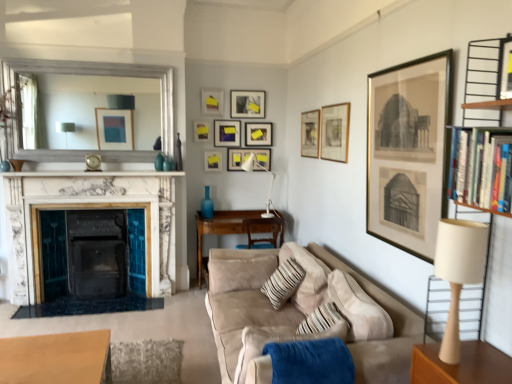
Question: Should I look upward or downward to see matte black picture frame at upper center, which is the 8th picture frame from front to back?

Choices:
 (A) down
 (B) up

Answer: (B)

Question: Is matte black picture frame at upper center, the 3th picture frame positioned from the back, closer to camera compared to suede couch at lower right?

Choices:
 (A) no
 (B) yes

Answer: (A)

Question: Is matte black picture frame at upper center, which is the 8th picture frame from front to back, shorter than suede couch at lower right?

Choices:
 (A) yes
 (B) no

Answer: (A)

Question: Considering the relative positions of matte black picture frame at upper center, the 3th picture frame positioned from the back, and suede couch at lower right in the image provided, is matte black picture frame at upper center, the 3th picture frame positioned from the back, behind suede couch at lower right?

Choices:
 (A) yes
 (B) no

Answer: (A)

Question: From the image's perspective, would you say matte black picture frame at upper center, the 3th picture frame positioned from the back, is shown under suede couch at lower right?

Choices:
 (A) no
 (B) yes

Answer: (A)

Question: Can you confirm if matte black picture frame at upper center, the 3th picture frame positioned from the back, is positioned to the left of suede couch at lower right?

Choices:
 (A) yes
 (B) no

Answer: (A)

Question: From a real-world perspective, is matte black picture frame at upper center, the 3th picture frame positioned from the back, beneath suede couch at lower right?

Choices:
 (A) yes
 (B) no

Answer: (B)

Question: Can you confirm if matte gold picture frame at upper right, which ranks as the second picture frame in front-to-back order, is bigger than gold-framed print at upper right, the 1th picture frame viewed from the front?

Choices:
 (A) yes
 (B) no

Answer: (B)

Question: Considering the relative positions of matte gold picture frame at upper right, which ranks as the second picture frame in front-to-back order, and gold-framed print at upper right, which appears as the tenth picture frame when viewed from the back, in the image provided, is matte gold picture frame at upper right, which ranks as the second picture frame in front-to-back order, to the right of gold-framed print at upper right, which appears as the tenth picture frame when viewed from the back, from the viewer's perspective?

Choices:
 (A) yes
 (B) no

Answer: (B)

Question: Considering the relative positions of matte gold picture frame at upper right, marked as the 9th picture frame in a back-to-front arrangement, and gold-framed print at upper right, the 1th picture frame viewed from the front, in the image provided, is matte gold picture frame at upper right, marked as the 9th picture frame in a back-to-front arrangement, in front of gold-framed print at upper right, the 1th picture frame viewed from the front,?

Choices:
 (A) no
 (B) yes

Answer: (A)

Question: Is matte gold picture frame at upper right, which ranks as the second picture frame in front-to-back order, thinner than gold-framed print at upper right, the 1th picture frame viewed from the front?

Choices:
 (A) no
 (B) yes

Answer: (B)

Question: Does matte gold picture frame at upper right, which ranks as the second picture frame in front-to-back order, have a greater width compared to gold-framed print at upper right, which appears as the tenth picture frame when viewed from the back?

Choices:
 (A) yes
 (B) no

Answer: (B)

Question: Is hardcover books at right facing away from wooden frame mirror at upper left?

Choices:
 (A) no
 (B) yes

Answer: (A)